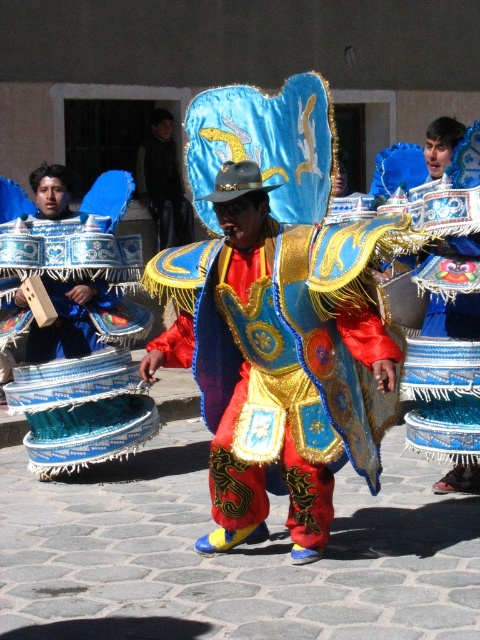
Can you confirm if blue woven basket at left is positioned to the right of velvet blue cape at center?

Incorrect, blue woven basket at left is not on the right side of velvet blue cape at center.

Can you confirm if blue woven basket at left is taller than velvet blue cape at center?

Yes.

Between point (81, 394) and point (136, 163), which one is positioned behind?

The point (136, 163) is more distant.

Image resolution: width=480 pixels, height=640 pixels. What are the coordinates of `blue woven basket at left` in the screenshot? It's located at (80, 352).

Is shiny metallic armor at center positioned at the back of velvet blue cape at center?

No, shiny metallic armor at center is closer to the viewer.

Looking at this image, does shiny metallic armor at center appear on the left side of velvet blue cape at center?

In fact, shiny metallic armor at center is to the right of velvet blue cape at center.

Which is behind, point (362, 292) or point (135, 164)?

The point (135, 164) is more distant.

Identify the location of shiny metallic armor at center. The width and height of the screenshot is (480, 640). pyautogui.click(x=280, y=362).

Between shiny metallic armor at center and blue woven basket at left, which one has less height?

With less height is blue woven basket at left.

Is shiny metallic armor at center smaller than blue woven basket at left?

No.

Which is in front, point (260, 508) or point (101, 241)?

Point (260, 508) is more forward.

Find the location of a particular element. shiny metallic armor at center is located at coordinates (280, 362).